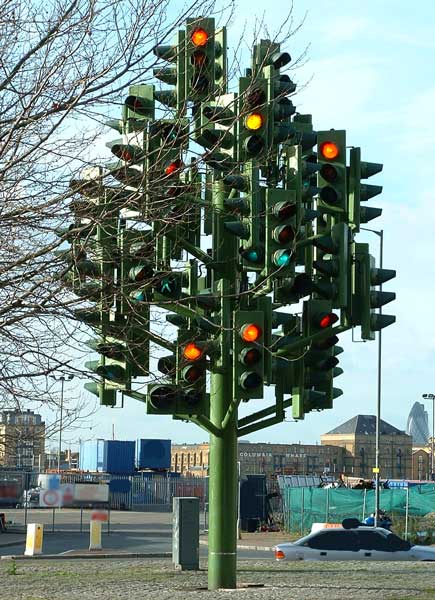
Find the location of a particular element. This screenshot has height=600, width=435. art is located at coordinates (196, 277), (282, 261), (326, 377).